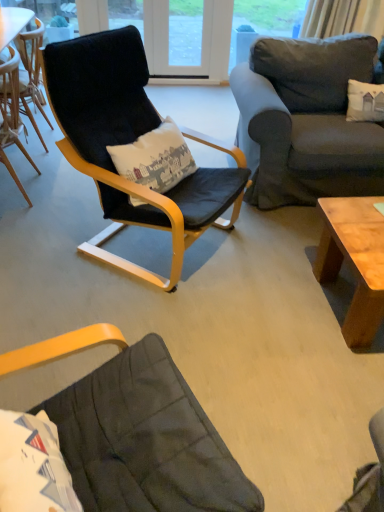
Locate an element on the screen. This screenshot has height=512, width=384. vacant space that is to the left of velvet black armchair at center, the second chair in the left-to-right sequence is located at coordinates (51, 233).